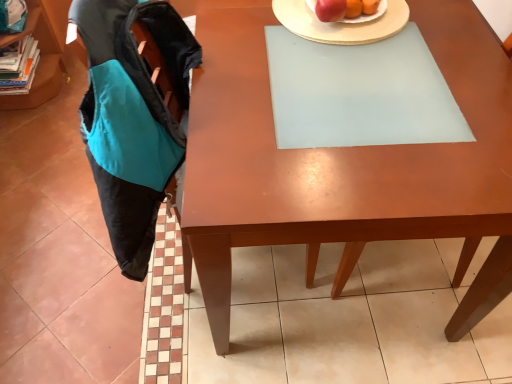
Locate an element on the screen. Image resolution: width=512 pixels, height=384 pixels. vacant space that is to the left of white ceramic plate at upper center is located at coordinates (234, 33).